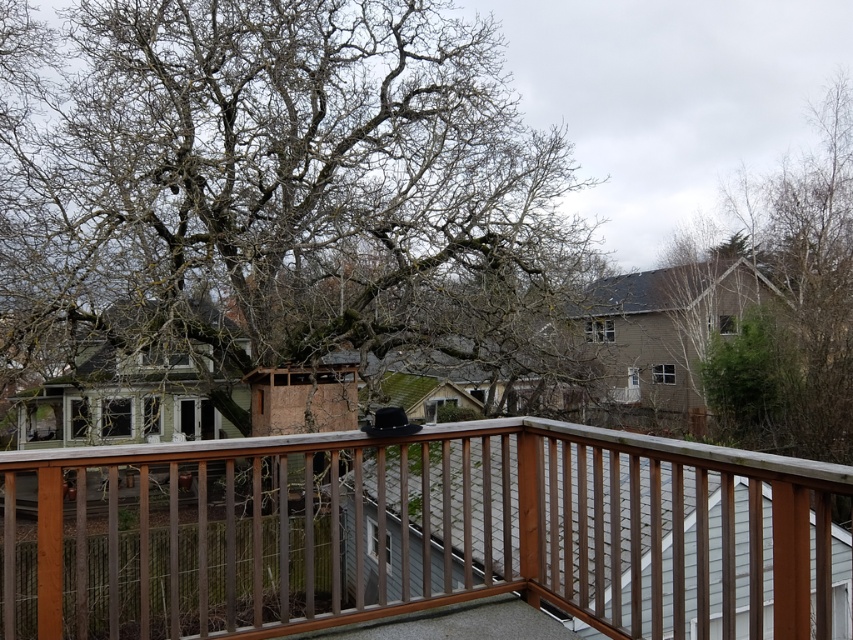
You are standing on the wooden deck and want to hang a bird feeder from the bare branches at center. The feeder requires a sturdy branch at least 1 meter in length. Can you determine if the branch is long enough based on the distance provided?

The distance between the viewer and the bare branches at center is 9.46 meters. However, the length of the branches themselves isn not specified in the description, so it is impossible to determine if they are at least 1 meter long based on the given information.

You are standing on the wooden deck and want to place a small potted plant between the bare branches at center and the brown wood railing at center. Is there enough space to place it there?

The bare branches at center are to the left of the brown wood railing at center, so there is space between them to place the small potted plant.

You are standing on the deck and want to hang a small bird feeder from the railing. The feeder requires at least 15 cm of space above it to avoid touching the branches. Can you safely hang it there based on the space between the bare branches at center and the brown wood railing at center?

The bare branches at center are larger than the brown wood railing at center. However, the exact distance between them isn